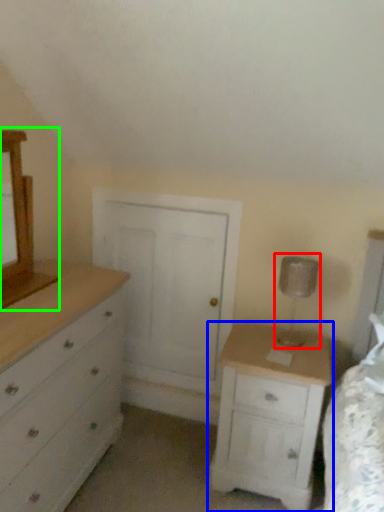
Question: Based on their relative distances, which object is farther from table lamp (highlighted by a red box)? Choose from nightstand (highlighted by a blue box) and medicine cabinet (highlighted by a green box).

Choices:
 (A) nightstand
 (B) medicine cabinet

Answer: (B)